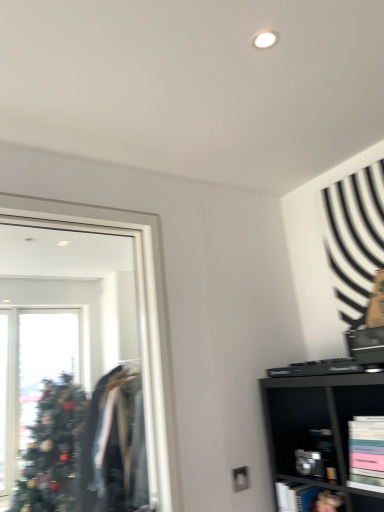
Measure the distance between metallic silver cabinet at lower right, marked as the first cabinet in a bottom-to-top arrangement, and camera.

metallic silver cabinet at lower right, marked as the first cabinet in a bottom-to-top arrangement, and camera are 1.61 meters apart from each other.

Measure the distance between clear glass mirror at left and camera.

The distance of clear glass mirror at left from camera is 1.55 meters.

This screenshot has width=384, height=512. I want to click on matte black bookshelf at lower right, the first cabinet viewed from the top, so click(356, 407).

Image resolution: width=384 pixels, height=512 pixels. What are the coordinates of `metallic silver cabinet at lower right, arranged as the 2th cabinet when viewed from the top` in the screenshot? It's located at (307, 498).

Is metallic silver cabinet at lower right, arranged as the 2th cabinet when viewed from the top, facing towards clear glass mirror at left?

No, metallic silver cabinet at lower right, arranged as the 2th cabinet when viewed from the top, is not facing towards clear glass mirror at left.

Between metallic silver cabinet at lower right, marked as the first cabinet in a bottom-to-top arrangement, and clear glass mirror at left, which one appears on the left side from the viewer's perspective?

From the viewer's perspective, clear glass mirror at left appears more on the left side.

Locate an element on the screen. The image size is (384, 512). mirror in front of the metallic silver cabinet at lower right, arranged as the 2th cabinet when viewed from the top is located at coordinates (140, 321).

Between point (304, 503) and point (156, 421), which one is positioned behind?

Positioned behind is point (156, 421).

Is clear glass mirror at left oriented towards metallic silver cabinet at lower right, arranged as the 2th cabinet when viewed from the top?

No, clear glass mirror at left does not turn towards metallic silver cabinet at lower right, arranged as the 2th cabinet when viewed from the top.

Considering the relative sizes of clear glass mirror at left and metallic silver cabinet at lower right, the second cabinet from the front, in the image provided, is clear glass mirror at left wider than metallic silver cabinet at lower right, the second cabinet from the front,?

Incorrect, the width of clear glass mirror at left does not surpass that of metallic silver cabinet at lower right, the second cabinet from the front.

Can metallic silver cabinet at lower right, the second cabinet from the front, be found inside clear glass mirror at left?

That's incorrect, metallic silver cabinet at lower right, the second cabinet from the front, is not inside clear glass mirror at left.

Between clear glass mirror at left and matte black bookshelf at lower right, positioned as the first cabinet in front-to-back order, which one appears on the right side from the viewer's perspective?

From the viewer's perspective, matte black bookshelf at lower right, positioned as the first cabinet in front-to-back order, appears more on the right side.

In terms of size, does clear glass mirror at left appear bigger or smaller than matte black bookshelf at lower right, acting as the 2th cabinet starting from the back?

Considering their sizes, clear glass mirror at left takes up more space than matte black bookshelf at lower right, acting as the 2th cabinet starting from the back.

From the image's perspective, is clear glass mirror at left positioned above or below matte black bookshelf at lower right, acting as the 2th cabinet starting from the back?

From the image's perspective, clear glass mirror at left appears above matte black bookshelf at lower right, acting as the 2th cabinet starting from the back.

From a real-world perspective, between matte black bookshelf at lower right, arranged as the 2th cabinet when ordered from the bottom, and metallic silver cabinet at lower right, arranged as the 2th cabinet when viewed from the top, who is vertically higher?

matte black bookshelf at lower right, arranged as the 2th cabinet when ordered from the bottom, from a real-world perspective.

Based on the photo, from the image's perspective, is matte black bookshelf at lower right, acting as the 2th cabinet starting from the back, above metallic silver cabinet at lower right, marked as the first cabinet in a bottom-to-top arrangement?

Yes, from the image's perspective, matte black bookshelf at lower right, acting as the 2th cabinet starting from the back, is above metallic silver cabinet at lower right, marked as the first cabinet in a bottom-to-top arrangement.

Is matte black bookshelf at lower right, acting as the 2th cabinet starting from the back, further to the viewer compared to metallic silver cabinet at lower right, arranged as the 2th cabinet when viewed from the top?

No, matte black bookshelf at lower right, acting as the 2th cabinet starting from the back, is closer to the camera.

Is point (357, 405) more distant than point (296, 492)?

Yes, point (357, 405) is behind point (296, 492).

From a real-world perspective, is matte black bookshelf at lower right, arranged as the 2th cabinet when ordered from the bottom, located higher than clear glass mirror at left?

No, from a real-world perspective, matte black bookshelf at lower right, arranged as the 2th cabinet when ordered from the bottom, is not over clear glass mirror at left

Which object is closer to the camera, matte black bookshelf at lower right, acting as the 2th cabinet starting from the back, or clear glass mirror at left?

clear glass mirror at left is in front.

Is matte black bookshelf at lower right, the first cabinet viewed from the top, to the right of clear glass mirror at left from the viewer's perspective?

Yes, matte black bookshelf at lower right, the first cabinet viewed from the top, is to the right of clear glass mirror at left.

Is matte black bookshelf at lower right, positioned as the first cabinet in front-to-back order, taller or shorter than clear glass mirror at left?

In the image, matte black bookshelf at lower right, positioned as the first cabinet in front-to-back order, appears to be shorter than clear glass mirror at left.

From the image's perspective, between metallic silver cabinet at lower right, marked as the first cabinet in a bottom-to-top arrangement, and matte black bookshelf at lower right, arranged as the 2th cabinet when ordered from the bottom, which one is located above?

matte black bookshelf at lower right, arranged as the 2th cabinet when ordered from the bottom, is shown above in the image.

From a real-world perspective, which object stands above the other?

From a 3D spatial view, matte black bookshelf at lower right, acting as the 2th cabinet starting from the back, is above.

Considering the positions of point (341, 506) and point (343, 387), is point (341, 506) closer or farther from the camera than point (343, 387)?

Point (341, 506) is closer to the camera than point (343, 387).

Is metallic silver cabinet at lower right, the second cabinet from the front, smaller than matte black bookshelf at lower right, acting as the 2th cabinet starting from the back?

Indeed, metallic silver cabinet at lower right, the second cabinet from the front, has a smaller size compared to matte black bookshelf at lower right, acting as the 2th cabinet starting from the back.

Starting from the clear glass mirror at left, which cabinet is the 2nd one behind? Please provide its 2D coordinates.

[(307, 498)]

Locate an element on the screen. The height and width of the screenshot is (512, 384). the 2nd cabinet located beneath the clear glass mirror at left (from a real-world perspective) is located at coordinates (307, 498).

Estimate the real-world distances between objects in this image. Which object is closer to metallic silver cabinet at lower right, arranged as the 2th cabinet when viewed from the top, matte black bookshelf at lower right, arranged as the 2th cabinet when ordered from the bottom, or clear glass mirror at left?

matte black bookshelf at lower right, arranged as the 2th cabinet when ordered from the bottom, lies closer to metallic silver cabinet at lower right, arranged as the 2th cabinet when viewed from the top, than the other object.

From the image, which object appears to be farther from matte black bookshelf at lower right, acting as the 2th cabinet starting from the back, metallic silver cabinet at lower right, the 1th cabinet viewed from the back, or clear glass mirror at left?

The object further to matte black bookshelf at lower right, acting as the 2th cabinet starting from the back, is clear glass mirror at left.

From the image, which object appears to be farther from clear glass mirror at left, metallic silver cabinet at lower right, the 1th cabinet viewed from the back, or matte black bookshelf at lower right, arranged as the 2th cabinet when ordered from the bottom?

matte black bookshelf at lower right, arranged as the 2th cabinet when ordered from the bottom, lies further to clear glass mirror at left than the other object.

Considering their positions, is matte black bookshelf at lower right, positioned as the first cabinet in front-to-back order, positioned further to clear glass mirror at left than metallic silver cabinet at lower right, the 1th cabinet viewed from the back?

Among the two, matte black bookshelf at lower right, positioned as the first cabinet in front-to-back order, is located further to clear glass mirror at left.

When comparing their distances from matte black bookshelf at lower right, arranged as the 2th cabinet when ordered from the bottom, does clear glass mirror at left or metallic silver cabinet at lower right, arranged as the 2th cabinet when viewed from the top, seem further?

Based on the image, clear glass mirror at left appears to be further to matte black bookshelf at lower right, arranged as the 2th cabinet when ordered from the bottom.

Estimate the real-world distances between objects in this image. Which object is closer to metallic silver cabinet at lower right, the second cabinet from the front, clear glass mirror at left or matte black bookshelf at lower right, arranged as the 2th cabinet when ordered from the bottom?

matte black bookshelf at lower right, arranged as the 2th cabinet when ordered from the bottom, is closer to metallic silver cabinet at lower right, the second cabinet from the front.

You are a GUI agent. You are given a task and a screenshot of the screen. Output one action in this format:
    pyautogui.click(x=<x>, y=<y>)
    Task: Click on the cabinet situated between clear glass mirror at left and matte black bookshelf at lower right, arranged as the 2th cabinet when ordered from the bottom, from left to right
    The image size is (384, 512).
    Given the screenshot: What is the action you would take?
    pyautogui.click(x=307, y=498)